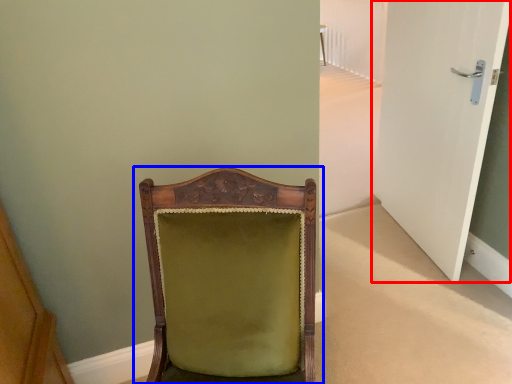
Question: Among these objects, which one is farthest to the camera, door (highlighted by a red box) or chair (highlighted by a blue box)?

Choices:
 (A) door
 (B) chair

Answer: (A)